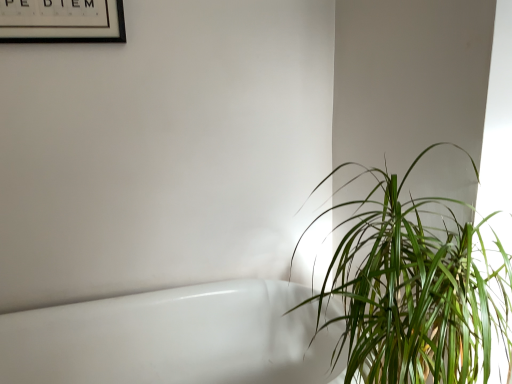
The height and width of the screenshot is (384, 512). What do you see at coordinates (173, 338) in the screenshot? I see `white glossy bathtub at lower left` at bounding box center [173, 338].

At what (x,y) coordinates should I click in order to perform the action: click on white glossy bathtub at lower left. Please return your answer as a coordinate pair (x, y). Looking at the image, I should click on (173, 338).

Measure the distance between point (x=39, y=0) and camera.

The depth of point (x=39, y=0) is 1.26 meters.

What is the approximate width of green leafy plant at right?

It is 24.98 inches.

The height and width of the screenshot is (384, 512). What are the coordinates of `white glossy bathtub at lower left` in the screenshot? It's located at [173, 338].

Considering the positions of objects black matte picture frame at upper left and white glossy bathtub at lower left in the image provided, who is more to the left, black matte picture frame at upper left or white glossy bathtub at lower left?

black matte picture frame at upper left.

Which point is more forward, (42, 18) or (292, 377)?

The point (42, 18) is closer to the camera.

From the picture: From a real-world perspective, is black matte picture frame at upper left above or below white glossy bathtub at lower left?

From a real-world perspective, black matte picture frame at upper left is physically above white glossy bathtub at lower left.

Is black matte picture frame at upper left looking in the opposite direction of white glossy bathtub at lower left?

black matte picture frame at upper left is not turned away from white glossy bathtub at lower left.

Between green leafy plant at right and black matte picture frame at upper left, which one has less height?

black matte picture frame at upper left.

From the picture: Visually, is green leafy plant at right positioned to the left or to the right of black matte picture frame at upper left?

Based on their positions, green leafy plant at right is located to the right of black matte picture frame at upper left.

Is green leafy plant at right next to black matte picture frame at upper left and touching it?

No.

From a real-world perspective, who is located lower, green leafy plant at right or black matte picture frame at upper left?

In real-world perspective, green leafy plant at right is lower.

Is white glossy bathtub at lower left located outside green leafy plant at right?

Yes, white glossy bathtub at lower left is not within green leafy plant at right.

From the image's perspective, which one is positioned lower, white glossy bathtub at lower left or green leafy plant at right?

white glossy bathtub at lower left.

Is white glossy bathtub at lower left in contact with green leafy plant at right?

white glossy bathtub at lower left and green leafy plant at right are not in contact.

Does white glossy bathtub at lower left have a smaller size compared to green leafy plant at right?

No.

Is white glossy bathtub at lower left taller than black matte picture frame at upper left?

Yes.

Is white glossy bathtub at lower left further to the viewer compared to black matte picture frame at upper left?

No.

Measure the distance between white glossy bathtub at lower left and black matte picture frame at upper left.

white glossy bathtub at lower left and black matte picture frame at upper left are 1.00 meters apart.

Find the location of a particular element. This screenshot has height=384, width=512. bath on the right of black matte picture frame at upper left is located at coordinates (173, 338).

Can you tell me how much black matte picture frame at upper left and green leafy plant at right differ in facing direction?

0.29 degrees.

Is point (48, 2) closer to camera compared to point (330, 294)?

No, it is not.

From the picture: Is black matte picture frame at upper left taller or shorter than green leafy plant at right?

Considering their sizes, black matte picture frame at upper left has less height than green leafy plant at right.

Considering the relative positions of black matte picture frame at upper left and green leafy plant at right in the image provided, is black matte picture frame at upper left in front of green leafy plant at right?

No, black matte picture frame at upper left is behind green leafy plant at right.

From a real-world perspective, which object rests below the other?

white glossy bathtub at lower left, from a real-world perspective.

Is point (507, 254) closer or farther from the camera than point (199, 372)?

Point (507, 254) is positioned closer to the camera compared to point (199, 372).

From their relative heights in the image, would you say green leafy plant at right is taller or shorter than white glossy bathtub at lower left?

Considering their sizes, green leafy plant at right has more height than white glossy bathtub at lower left.

Is green leafy plant at right looking in the opposite direction of white glossy bathtub at lower left?

No.

Find the location of a particular element. The width and height of the screenshot is (512, 384). picture frame lying on the left of white glossy bathtub at lower left is located at coordinates (62, 21).

This screenshot has height=384, width=512. I want to click on houseplant on the right side of black matte picture frame at upper left, so click(x=416, y=290).

From the image, which object appears to be nearer to black matte picture frame at upper left, green leafy plant at right or white glossy bathtub at lower left?

white glossy bathtub at lower left lies closer to black matte picture frame at upper left than the other object.

When comparing their distances from green leafy plant at right, does white glossy bathtub at lower left or black matte picture frame at upper left seem closer?

Based on the image, white glossy bathtub at lower left appears to be nearer to green leafy plant at right.

Looking at this image, looking at the image, which one is located closer to black matte picture frame at upper left, white glossy bathtub at lower left or green leafy plant at right?

Among the two, white glossy bathtub at lower left is located nearer to black matte picture frame at upper left.

From the image, which object appears to be nearer to green leafy plant at right, black matte picture frame at upper left or white glossy bathtub at lower left?

white glossy bathtub at lower left is positioned closer to the anchor green leafy plant at right.

Which object lies further to the anchor point white glossy bathtub at lower left, black matte picture frame at upper left or green leafy plant at right?

Based on the image, black matte picture frame at upper left appears to be further to white glossy bathtub at lower left.

Looking at the image, which one is located closer to white glossy bathtub at lower left, green leafy plant at right or black matte picture frame at upper left?

Among the two, green leafy plant at right is located nearer to white glossy bathtub at lower left.

What are the coordinates of `houseplant that lies between black matte picture frame at upper left and white glossy bathtub at lower left from top to bottom` in the screenshot? It's located at (416, 290).